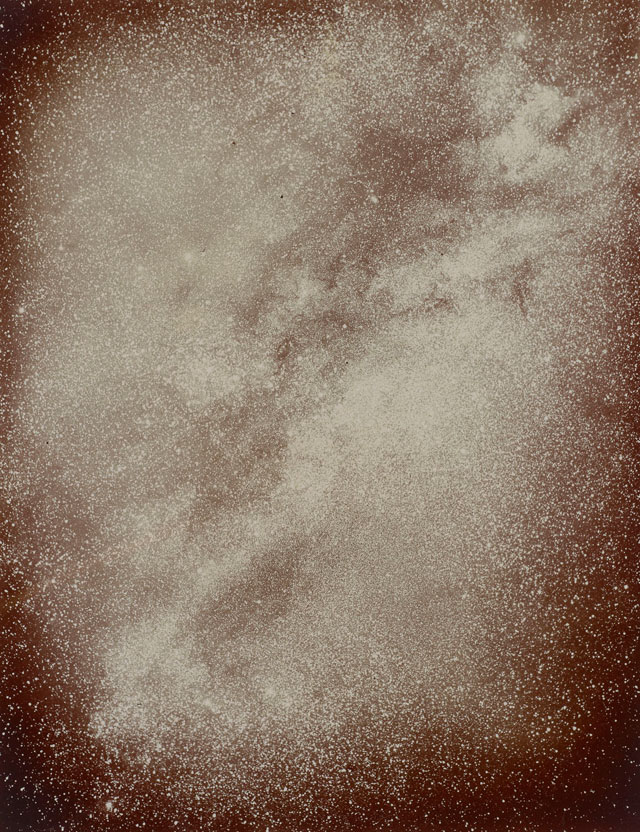
At what (x,y) coordinates should I click in order to perform the action: click on table. Please return your answer as a coordinate pair (x, y). Image resolution: width=640 pixels, height=832 pixels. Looking at the image, I should click on coord(26,743).